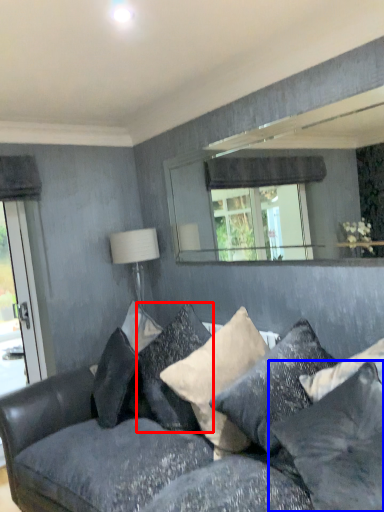
Question: Which of the following is the farthest to the observer, pillow (highlighted by a red box) or pillow (highlighted by a blue box)?

Choices:
 (A) pillow
 (B) pillow

Answer: (A)